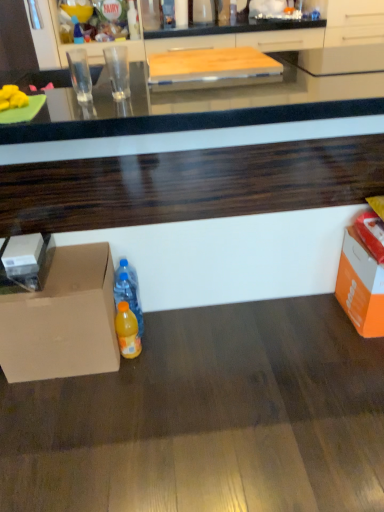
The height and width of the screenshot is (512, 384). Find the location of `free space above matte cardboard box at lower left (from a real-world perspective)`. free space above matte cardboard box at lower left (from a real-world perspective) is located at coordinates (54, 266).